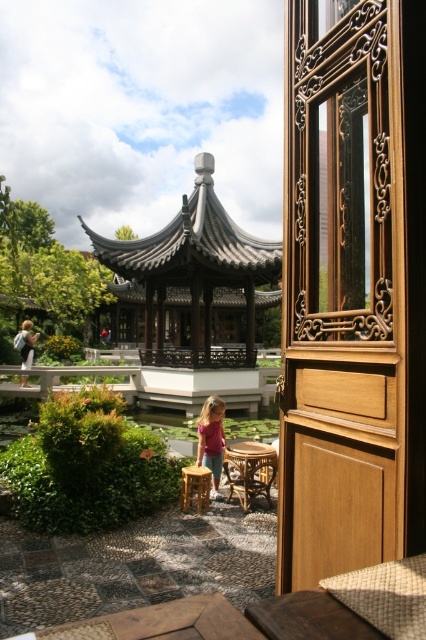
You are standing inside the room looking through the wooden window frame on the right. You see a green leafy bush at lower left and a pink fabric dress at center. Which object is taller?

The green leafy bush at lower left is taller than the pink fabric dress at center.

You are standing inside a traditional room and looking through the wooden window frame on the right. You see a green leafy bush at lower left and a pink fabric dress at center. Which object is wider?

The green leafy bush at lower left might be wider than the pink fabric dress at center.

You are standing in a traditional room with a wooden carved door at right. You want to exit through the door but need to know if your 1.85 meter long luggage can fit through the doorway. Can it pass through?

The wooden carved door at right is 1.90 meters from viewer. Since the luggage is 1.85 meters long, it is slightly shorter than the distance to the door, so it should fit through the doorway.